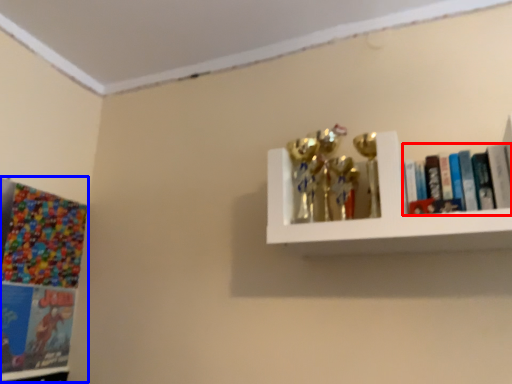
Question: Which object appears farthest to the camera in this image, book (highlighted by a red box) or comic book (highlighted by a blue box)?

Choices:
 (A) book
 (B) comic book

Answer: (B)